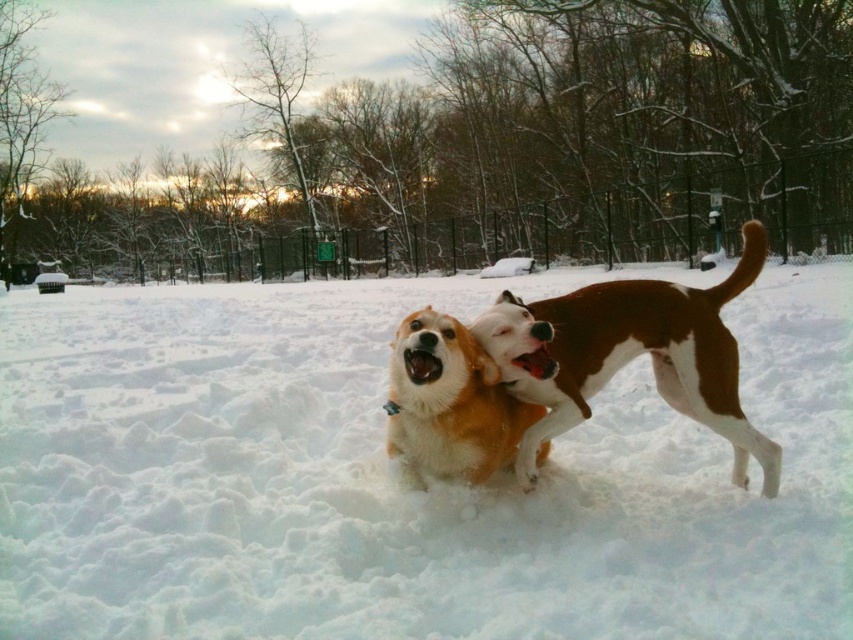
Question: Can you confirm if brown/white fur dog at center is positioned to the left of soft fur dog at center?

Choices:
 (A) yes
 (B) no

Answer: (B)

Question: Estimate the real-world distances between objects in this image. Which object is closer to the brown/white fur dog at center?

Choices:
 (A) white fluffy snow at center
 (B) soft fur dog at center

Answer: (B)

Question: Does white fluffy snow at center appear over soft fur dog at center?

Choices:
 (A) no
 (B) yes

Answer: (B)

Question: Which object is the closest to the soft fur dog at center?

Choices:
 (A) white fluffy snow at center
 (B) brown/white fur dog at center

Answer: (B)

Question: Can you confirm if white fluffy snow at center is positioned to the right of brown/white fur dog at center?

Choices:
 (A) yes
 (B) no

Answer: (B)

Question: Which point appears farthest from the camera in this image?

Choices:
 (A) (447, 449)
 (B) (367, 550)

Answer: (A)